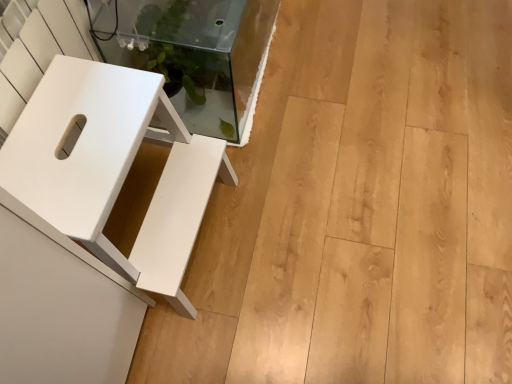
Question: Considering the positions of white matte stool at left and transparent glass table at upper left in the image, is white matte stool at left taller or shorter than transparent glass table at upper left?

Choices:
 (A) tall
 (B) short

Answer: (A)

Question: Looking at the image, does white matte stool at left seem bigger or smaller compared to transparent glass table at upper left?

Choices:
 (A) small
 (B) big

Answer: (A)

Question: Considering the positions of white matte stool at left and transparent glass table at upper left in the image, is white matte stool at left wider or thinner than transparent glass table at upper left?

Choices:
 (A) thin
 (B) wide

Answer: (B)

Question: From a real-world perspective, is transparent glass table at upper left above or below white matte stool at left?

Choices:
 (A) below
 (B) above

Answer: (A)

Question: Does point pyautogui.click(x=232, y=92) appear closer or farther from the camera than point pyautogui.click(x=126, y=165)?

Choices:
 (A) closer
 (B) farther

Answer: (B)

Question: Considering the positions of transparent glass table at upper left and white matte stool at left in the image, is transparent glass table at upper left bigger or smaller than white matte stool at left?

Choices:
 (A) big
 (B) small

Answer: (A)

Question: Is transparent glass table at upper left to the left or to the right of white matte stool at left in the image?

Choices:
 (A) left
 (B) right

Answer: (B)